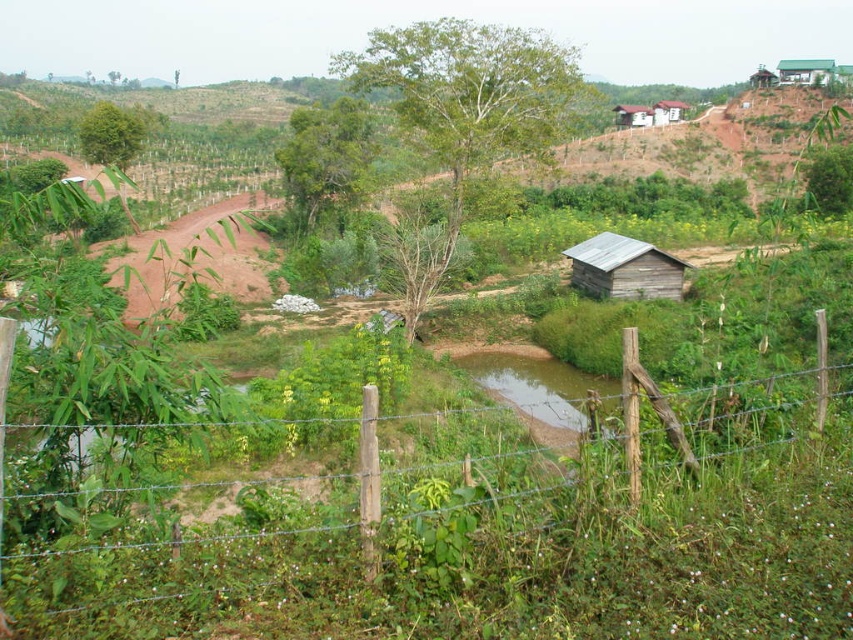
Question: Which object is the closest to the weathered wood hut at center-right?

Choices:
 (A) wooden shack at upper right
 (B) wooden hut at upper right
 (C) wooden post fence at lower center

Answer: (C)

Question: Is wooden shack at upper right to the right of wooden hut at upper right from the viewer's perspective?

Choices:
 (A) yes
 (B) no

Answer: (B)

Question: Which of the following is the farthest from the observer?

Choices:
 (A) wooden post fence at lower center
 (B) weathered wood hut at center-right

Answer: (B)

Question: Which point is farther to the camera?

Choices:
 (A) (682, 100)
 (B) (834, 74)
 (C) (639, 115)
 (D) (602, 291)

Answer: (A)

Question: Can you confirm if wooden post fence at lower center is positioned below green corrugated metal hut at upper right?

Choices:
 (A) yes
 (B) no

Answer: (A)

Question: Can you confirm if wooden post fence at lower center is wider than weathered wood hut at center-right?

Choices:
 (A) yes
 (B) no

Answer: (A)